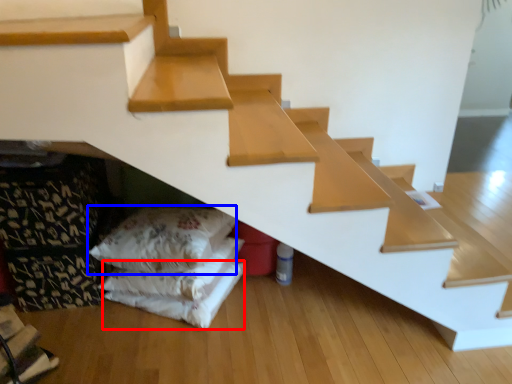
Question: Among these objects, which one is farthest to the camera, sheet (highlighted by a red box) or pillow (highlighted by a blue box)?

Choices:
 (A) sheet
 (B) pillow

Answer: (A)